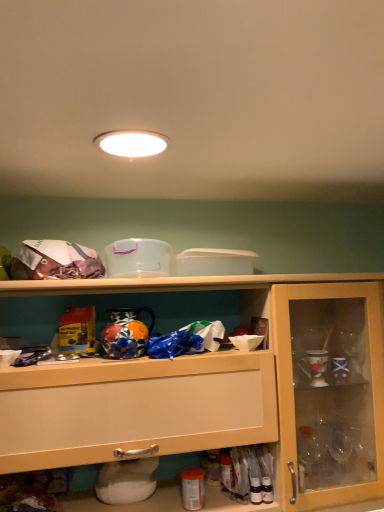
Where is `blank space above white glossy light fixture at upper center (from a real-world perspective)`? The image size is (384, 512). blank space above white glossy light fixture at upper center (from a real-world perspective) is located at coordinates point(129,144).